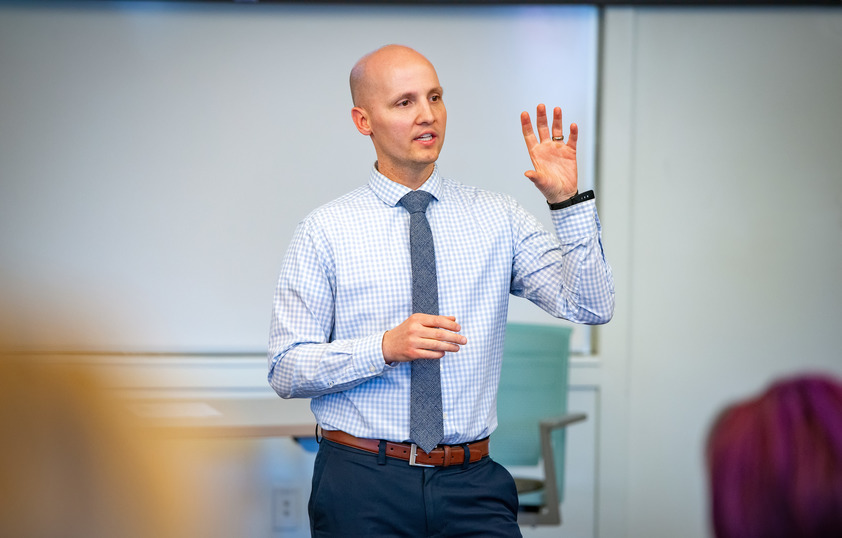
Identify the location of chair. (512, 445).